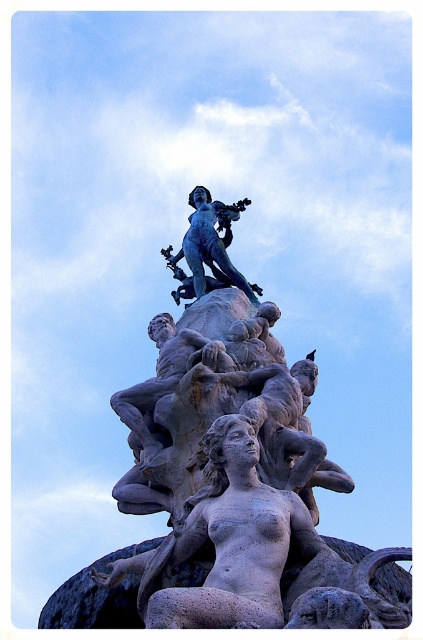
Question: Is smooth gray statue at center positioned in front of blue patina statue at upper center?

Choices:
 (A) yes
 (B) no

Answer: (A)

Question: Can you confirm if smooth gray statue at center is positioned to the right of blue patina statue at upper center?

Choices:
 (A) no
 (B) yes

Answer: (A)

Question: Estimate the real-world distances between objects in this image. Which object is closer to the smooth gray statue at center?

Choices:
 (A) blue patina statue at upper center
 (B) gray stone statue at center

Answer: (B)

Question: Among these objects, which one is farthest from the camera?

Choices:
 (A) smooth gray statue at center
 (B) gray stone statue at center
 (C) blue patina statue at upper center

Answer: (C)

Question: Which point is closer to the camera?

Choices:
 (A) smooth gray statue at center
 (B) blue patina statue at upper center

Answer: (A)

Question: Can you confirm if gray stone statue at center is smaller than blue patina statue at upper center?

Choices:
 (A) yes
 (B) no

Answer: (A)